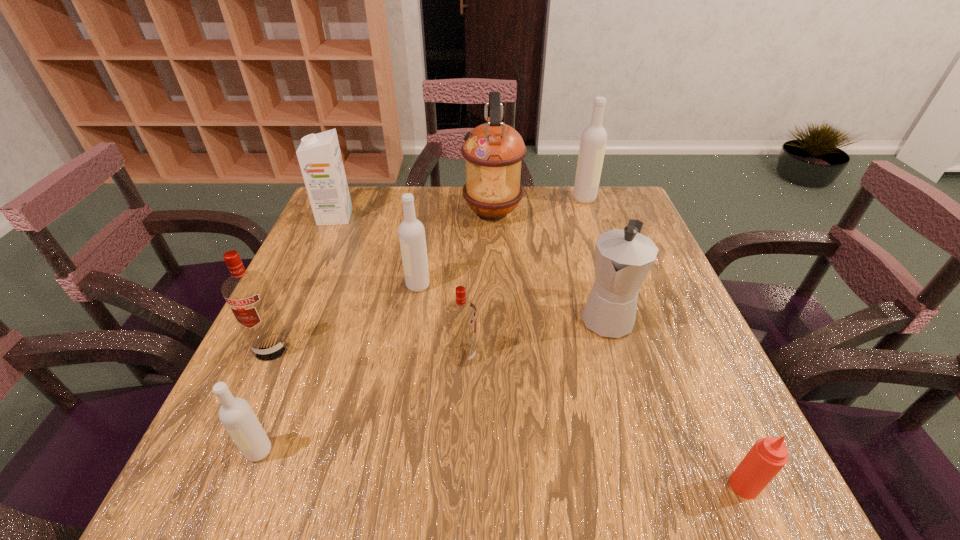
The height and width of the screenshot is (540, 960). Identify the location of coffeepot positioned at the right edge. (623, 258).

In order to click on Tabasco sauce that is at the right edge in this screenshot , I will do `click(769, 455)`.

Locate an element on the screen. object present at the far left corner is located at coordinates (319, 155).

The width and height of the screenshot is (960, 540). In order to click on object present at the near left corner in this screenshot , I will do `click(236, 415)`.

Where is `object situated at the far right corner`? The width and height of the screenshot is (960, 540). object situated at the far right corner is located at coordinates (593, 141).

You are a GUI agent. You are given a task and a screenshot of the screen. Output one action in this format:
    pyautogui.click(x=<x>, y=<y>)
    Task: Click on the object that is positioned at the near right corner
    The height and width of the screenshot is (540, 960).
    Given the screenshot: What is the action you would take?
    pyautogui.click(x=769, y=455)

The width and height of the screenshot is (960, 540). In the image, there is a desktop. Identify the location of vacant space at the far edge. (385, 205).

Locate an element on the screen. This screenshot has width=960, height=540. free space at the left edge of the desktop is located at coordinates (307, 275).

You are a GUI agent. You are given a task and a screenshot of the screen. Output one action in this format:
    pyautogui.click(x=<x>, y=<y>)
    Task: Click on the vacant region at the right edge of the desktop
    
    Given the screenshot: What is the action you would take?
    pyautogui.click(x=660, y=406)

Image resolution: width=960 pixels, height=540 pixels. I want to click on vacant space at the far left corner, so click(359, 213).